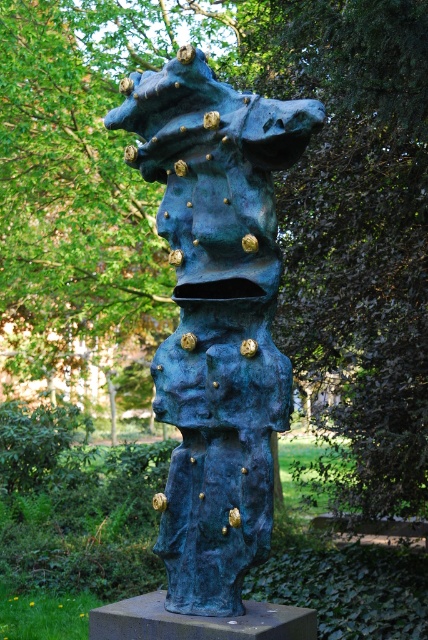
Question: Which point appears closest to the camera in this image?

Choices:
 (A) (303, 618)
 (B) (217, 186)

Answer: (A)

Question: Considering the relative positions of blue patinated bronze sculpture at center and bronze pedestal at center in the image provided, where is blue patinated bronze sculpture at center located with respect to bronze pedestal at center?

Choices:
 (A) left
 (B) right

Answer: (B)

Question: Which point is closer to the camera?

Choices:
 (A) blue patinated bronze sculpture at center
 (B) bronze pedestal at center

Answer: (B)

Question: Can you confirm if blue patinated bronze sculpture at center is positioned above bronze pedestal at center?

Choices:
 (A) yes
 (B) no

Answer: (A)

Question: Can you confirm if blue patinated bronze sculpture at center is positioned below bronze pedestal at center?

Choices:
 (A) yes
 (B) no

Answer: (B)